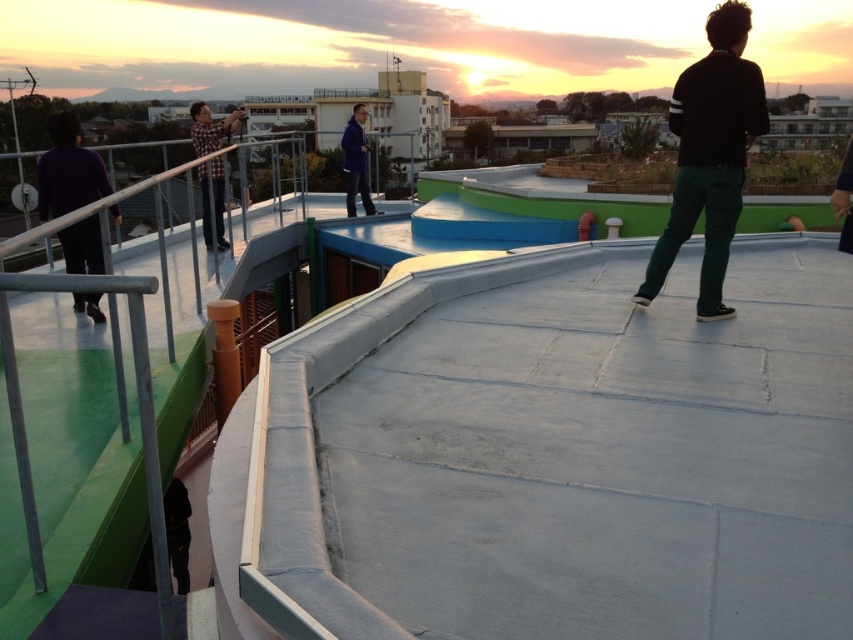
Is black matte sweater at upper right positioned before blue fabric jacket at center?

Yes, it is.

Can you confirm if black matte sweater at upper right is thinner than blue fabric jacket at center?

Yes.

At what (x,y) coordinates should I click in order to perform the action: click on black matte sweater at upper right. Please return your answer as a coordinate pair (x, y). This screenshot has height=640, width=853. Looking at the image, I should click on (711, 156).

Identify the location of black matte sweater at upper right. The width and height of the screenshot is (853, 640). (711, 156).

Is plaid shirt at upper left bigger than blue fabric jacket at center?

Correct, plaid shirt at upper left is larger in size than blue fabric jacket at center.

The image size is (853, 640). Describe the element at coordinates (210, 128) in the screenshot. I see `plaid shirt at upper left` at that location.

At what (x,y) coordinates should I click in order to perform the action: click on plaid shirt at upper left. Please return your answer as a coordinate pair (x, y). Image resolution: width=853 pixels, height=640 pixels. Looking at the image, I should click on pos(210,128).

Can you confirm if purple matte pants at left is positioned above blue fabric jacket at center?

No, purple matte pants at left is not above blue fabric jacket at center.

Who is shorter, purple matte pants at left or blue fabric jacket at center?

purple matte pants at left

Does point (68, 145) come farther from viewer compared to point (357, 148)?

No, (68, 145) is in front of (357, 148).

Where is `purple matte pants at left`? purple matte pants at left is located at coordinates (68, 170).